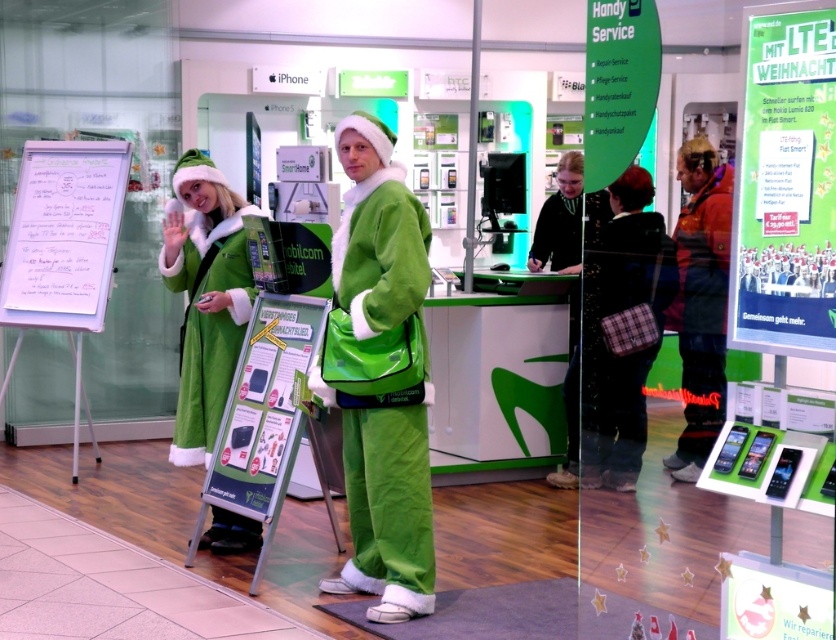
From the picture: Does plaid fabric purse at center appear under green fleece santa hat at center?

Yes, plaid fabric purse at center is below green fleece santa hat at center.

Is point (584, 412) farther from viewer compared to point (534, 240)?

No.

Is point (666, 289) positioned before point (549, 266)?

That is True.

Identify the location of plaid fabric purse at center. (622, 332).

Is white paperboard at center above green fabric santa suit at center?

Yes, white paperboard at center is above green fabric santa suit at center.

Which of these two, white paperboard at center or green fabric santa suit at center, stands taller?

Standing taller between the two is white paperboard at center.

The height and width of the screenshot is (640, 836). What do you see at coordinates (64, 234) in the screenshot?
I see `white paperboard at center` at bounding box center [64, 234].

The width and height of the screenshot is (836, 640). Identify the location of white paperboard at center. (64, 234).

Is green fleece coat at left below white paperboard at center?

Indeed, green fleece coat at left is positioned under white paperboard at center.

Does green fleece coat at left appear on the right side of white paperboard at center?

Yes, green fleece coat at left is to the right of white paperboard at center.

Where is `green fleece coat at left`? green fleece coat at left is located at coordinates (205, 298).